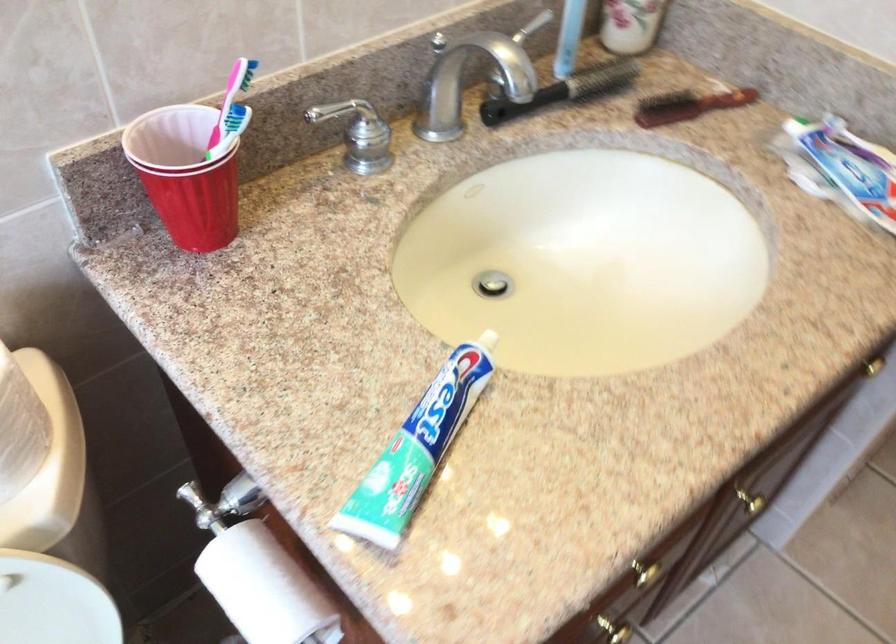
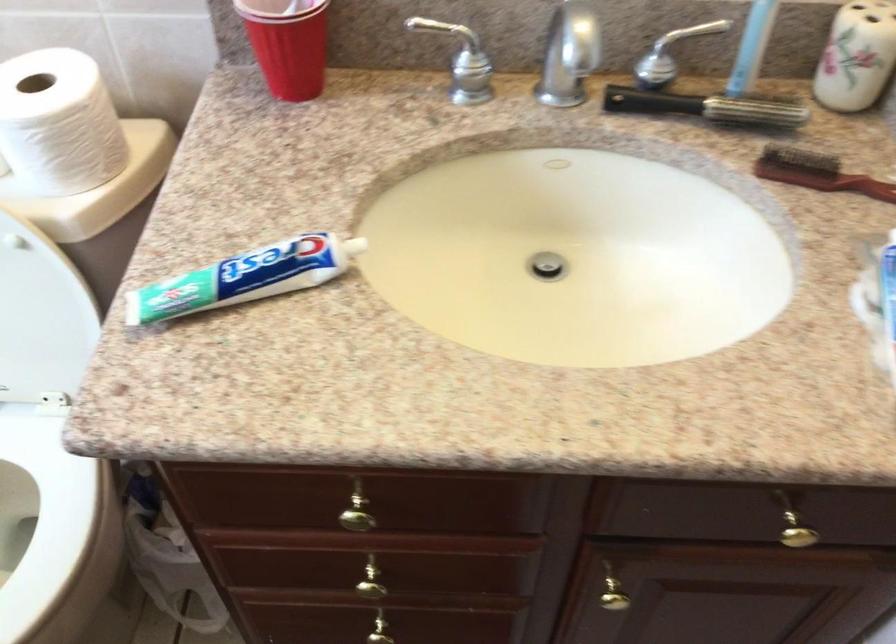
In the second image, find the point that corresponds to pixel 570 87 in the first image.

(707, 107)